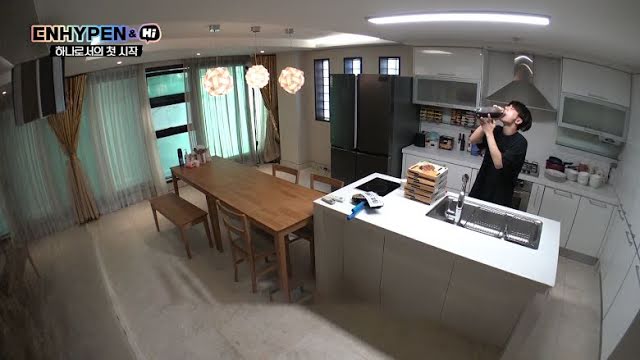
This screenshot has width=640, height=360. In order to click on fridge in this screenshot , I will do `click(380, 115)`.